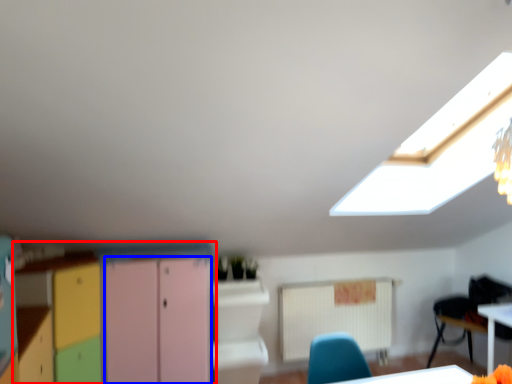
Question: Which of the following is the farthest to the observer, cabinetry (highlighted by a red box) or file cabinet (highlighted by a blue box)?

Choices:
 (A) cabinetry
 (B) file cabinet

Answer: (B)